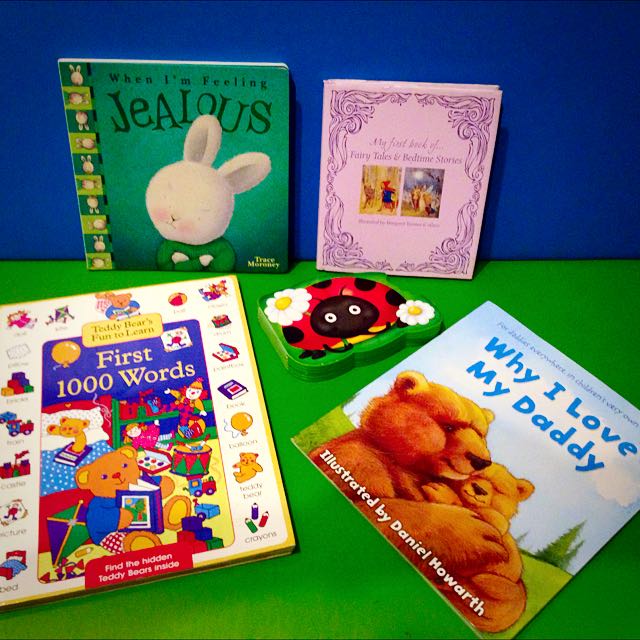
I want to click on book, first 100 words, so click(x=137, y=379).